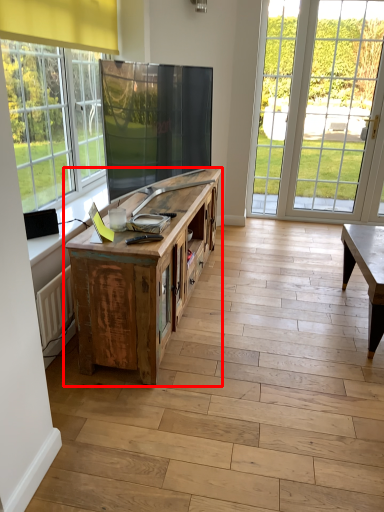
Question: From the image's perspective, what is the correct spatial positioning of cabinetry (annotated by the red box) in reference to glass door?

Choices:
 (A) below
 (B) above

Answer: (A)